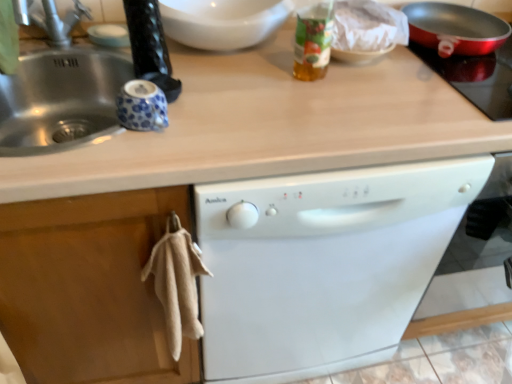
Question: Considering the relative sizes of metallic red pan at upper right and white glossy bowl at upper center in the image provided, is metallic red pan at upper right bigger than white glossy bowl at upper center?

Choices:
 (A) no
 (B) yes

Answer: (B)

Question: Does metallic red pan at upper right have a smaller size compared to white glossy bowl at upper center?

Choices:
 (A) yes
 (B) no

Answer: (B)

Question: From the image's perspective, is metallic red pan at upper right under white glossy bowl at upper center?

Choices:
 (A) no
 (B) yes

Answer: (B)

Question: Is metallic red pan at upper right at the right side of white glossy bowl at upper center?

Choices:
 (A) yes
 (B) no

Answer: (A)

Question: Does metallic red pan at upper right have a greater height compared to white glossy bowl at upper center?

Choices:
 (A) yes
 (B) no

Answer: (B)

Question: From a real-world perspective, is metallic red pan at upper right located higher than white glossy bowl at upper center?

Choices:
 (A) yes
 (B) no

Answer: (B)

Question: Is silver metallic faucet at upper left behind metallic red pan at upper right?

Choices:
 (A) yes
 (B) no

Answer: (B)

Question: Considering the relative positions of silver metallic faucet at upper left and metallic red pan at upper right in the image provided, is silver metallic faucet at upper left in front of metallic red pan at upper right?

Choices:
 (A) no
 (B) yes

Answer: (B)

Question: Is silver metallic faucet at upper left looking in the opposite direction of metallic red pan at upper right?

Choices:
 (A) no
 (B) yes

Answer: (A)

Question: Considering the relative positions of silver metallic faucet at upper left and metallic red pan at upper right in the image provided, is silver metallic faucet at upper left to the left of metallic red pan at upper right from the viewer's perspective?

Choices:
 (A) yes
 (B) no

Answer: (A)

Question: Can you see silver metallic faucet at upper left touching metallic red pan at upper right?

Choices:
 (A) yes
 (B) no

Answer: (B)

Question: Is silver metallic faucet at upper left outside metallic red pan at upper right?

Choices:
 (A) yes
 (B) no

Answer: (A)

Question: Can you confirm if translucent plastic bottle at upper center is smaller than metallic red pan at upper right?

Choices:
 (A) yes
 (B) no

Answer: (A)